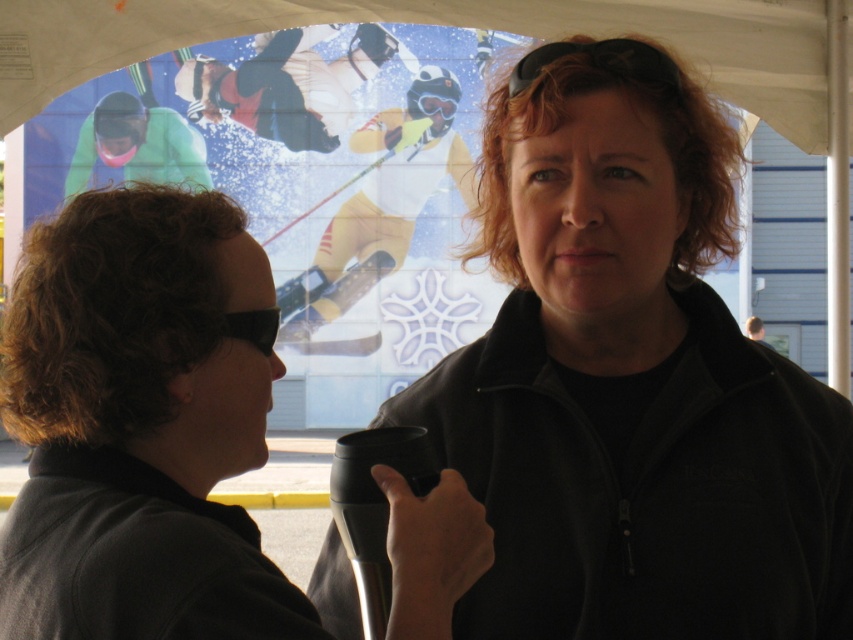
Can you confirm if matte black snowboarder at upper center is smaller than black matte sunglasses at upper center?

No, matte black snowboarder at upper center is not smaller than black matte sunglasses at upper center.

Is point (306, 109) behind point (556, 42)?

Yes, point (306, 109) is behind point (556, 42).

Which is in front, point (177, 90) or point (521, 81)?

Point (521, 81) is in front.

At what (x,y) coordinates should I click in order to perform the action: click on matte black snowboarder at upper center. Please return your answer as a coordinate pair (x, y). Looking at the image, I should click on (288, 84).

Between matte black snowboarder at upper center and black plastic goggles at upper left, which one appears on the right side from the viewer's perspective?

black plastic goggles at upper left

Who is positioned more to the left, matte black snowboarder at upper center or black plastic goggles at upper left?

matte black snowboarder at upper center is more to the left.

Does point (286, 88) come closer to viewer compared to point (241, 314)?

No.

Find the location of a particular element. The height and width of the screenshot is (640, 853). matte black snowboarder at upper center is located at coordinates click(x=288, y=84).

Is matte black mug at center below black plastic goggles at upper left?

Correct, matte black mug at center is located below black plastic goggles at upper left.

Who is higher up, matte black mug at center or black plastic goggles at upper left?

black plastic goggles at upper left

Locate an element on the screen. Image resolution: width=853 pixels, height=640 pixels. matte black mug at center is located at coordinates (138, 426).